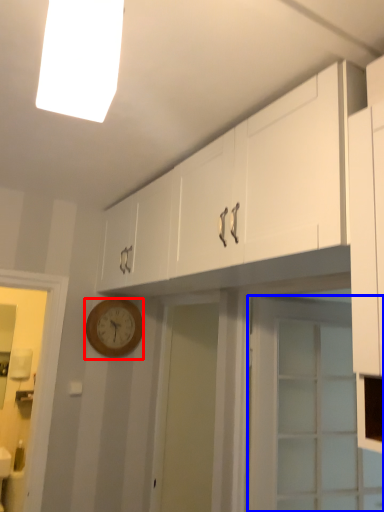
Question: Among these objects, which one is nearest to the camera, wall clock (highlighted by a red box) or door (highlighted by a blue box)?

Choices:
 (A) wall clock
 (B) door

Answer: (B)